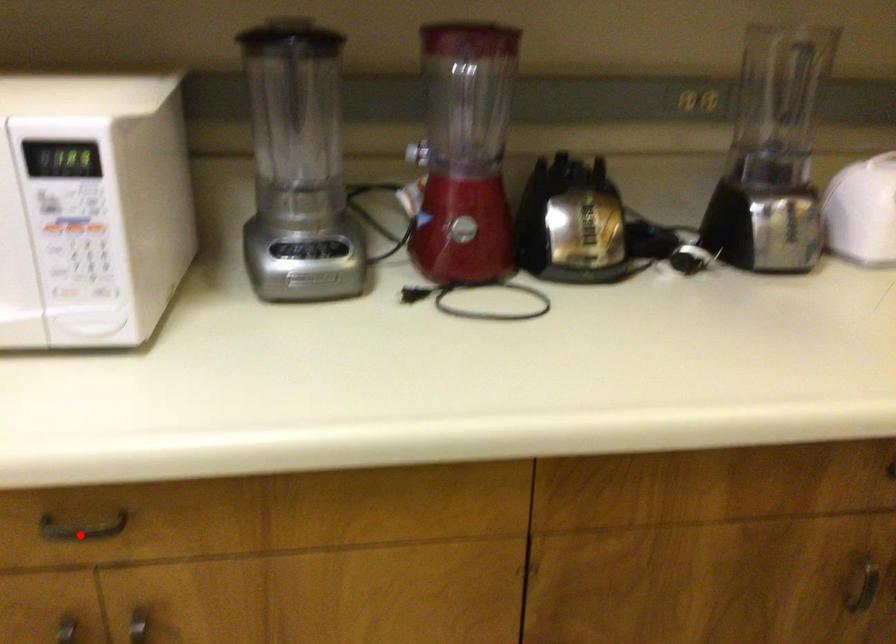
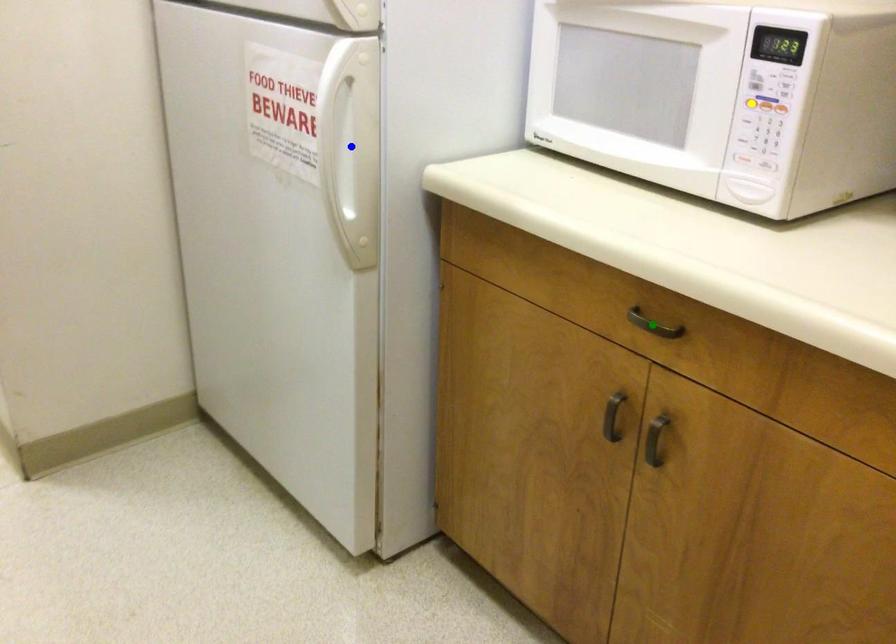
Question: I am providing you with two images of the same scene from different viewpoints. A red point is marked on the first image. You are given multiple points on the second image. Which spot in image 2 lines up with the point in image 1?

Choices:
 (A) green point
 (B) yellow point
 (C) blue point

Answer: (A)